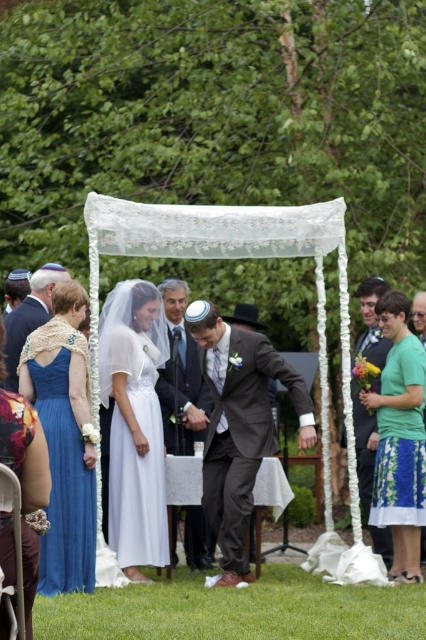
Question: Among these points, which one is farthest from the camera?

Choices:
 (A) (354, 400)
 (B) (62, 429)
 (C) (172, 515)

Answer: (A)

Question: Which of the following is the farthest from the observer?

Choices:
 (A) (412, 515)
 (B) (62, 467)
 (C) (238, 358)

Answer: (A)

Question: Based on their relative distances, which object is nearer to the dark gray suit at center?

Choices:
 (A) matte black suit at center
 (B) matte blue dress at left

Answer: (B)

Question: Is matte gray suit at center below matte black suit at center?

Choices:
 (A) no
 (B) yes

Answer: (B)

Question: Is white satin dress at center further to the viewer compared to dark gray suit at center?

Choices:
 (A) no
 (B) yes

Answer: (B)

Question: Does matte black suit at center appear on the right side of green fabric shirt at center?

Choices:
 (A) yes
 (B) no

Answer: (B)